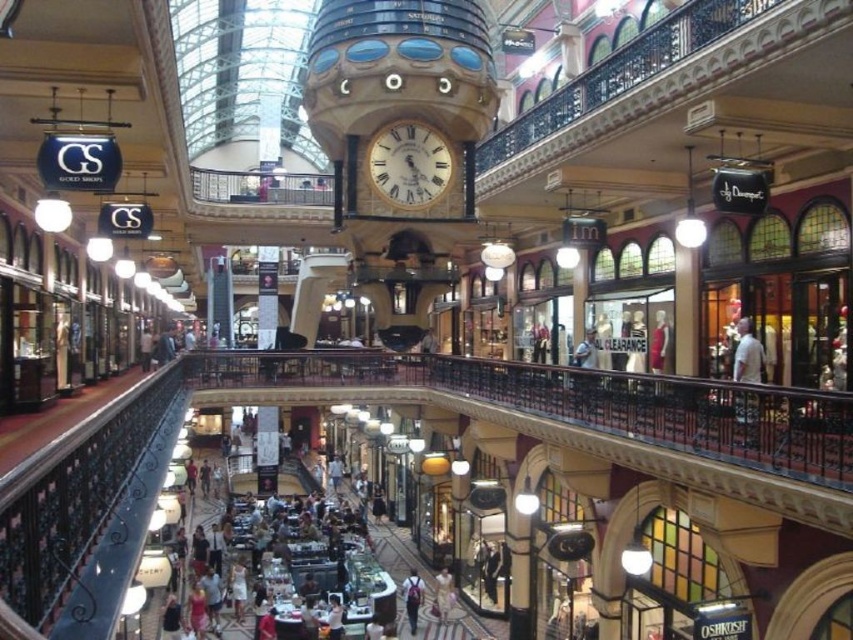
Question: Does gold metallic clock at center appear on the right side of matte gray backpack at center?

Choices:
 (A) yes
 (B) no

Answer: (A)

Question: Can you confirm if gold metallic clock at center is wider than matte gray backpack at center?

Choices:
 (A) no
 (B) yes

Answer: (A)

Question: Which point is closer to the camera?

Choices:
 (A) (427, 170)
 (B) (412, 573)

Answer: (A)

Question: Is gold metallic clock at center wider than matte gray backpack at center?

Choices:
 (A) no
 (B) yes

Answer: (A)